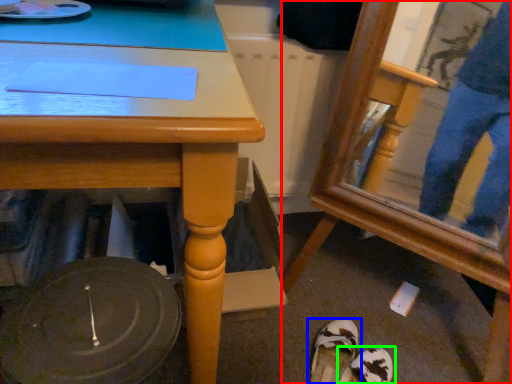
Question: Which object is the farthest from swivel chair (highlighted by a red box)? Choose among these: footwear (highlighted by a blue box) or footwear (highlighted by a green box).

Choices:
 (A) footwear
 (B) footwear

Answer: (B)